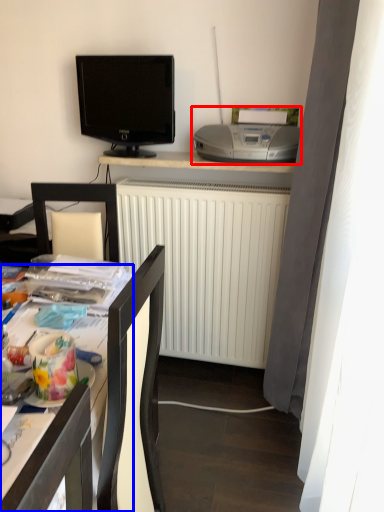
Question: Which object is closer to the camera taking this photo, printer (highlighted by a red box) or desk (highlighted by a blue box)?

Choices:
 (A) printer
 (B) desk

Answer: (B)